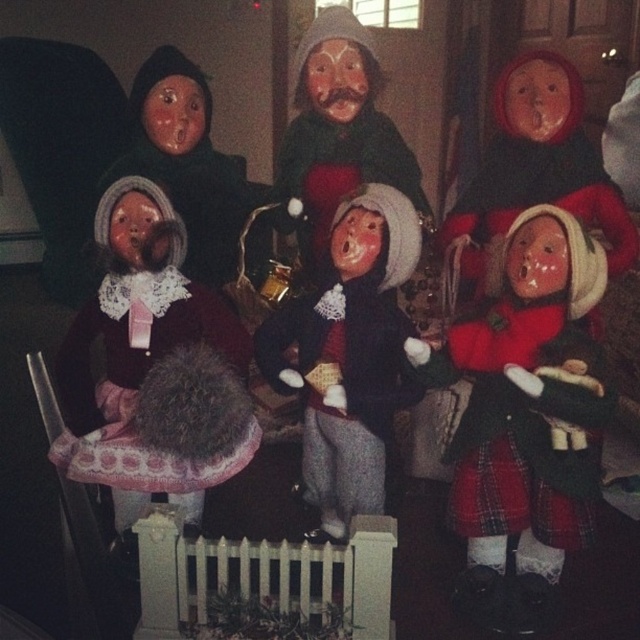
Can you confirm if velvet maroon dress at left is positioned to the right of matte black doll at center?

In fact, velvet maroon dress at left is to the left of matte black doll at center.

Can you confirm if velvet maroon dress at left is bigger than matte black doll at center?

Correct, velvet maroon dress at left is larger in size than matte black doll at center.

Who is more distant from viewer, (118, 420) or (298, 310)?

Point (298, 310)

This screenshot has width=640, height=640. I want to click on velvet maroon dress at left, so click(145, 362).

Who is higher up, red plaid skirt at center or velvet maroon dress at left?

Positioned higher is velvet maroon dress at left.

Between point (582, 269) and point (122, 346), which one is positioned behind?

The point (122, 346) is more distant.

The width and height of the screenshot is (640, 640). Describe the element at coordinates (524, 397) in the screenshot. I see `red plaid skirt at center` at that location.

Locate an element on the screen. red plaid skirt at center is located at coordinates (524, 397).

Is red plaid skirt at center positioned behind matte black doll at center?

No, it is in front of matte black doll at center.

Does red plaid skirt at center have a smaller size compared to matte black doll at center?

Indeed, red plaid skirt at center has a smaller size compared to matte black doll at center.

Where is `red plaid skirt at center`? The image size is (640, 640). red plaid skirt at center is located at coordinates (524, 397).

This screenshot has width=640, height=640. In order to click on red plaid skirt at center in this screenshot , I will do `click(524, 397)`.